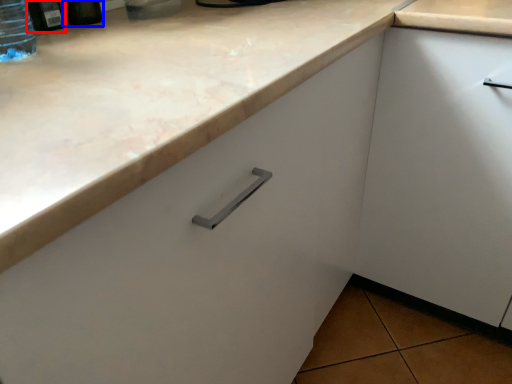
Question: Among these objects, which one is farthest to the camera, bottle (highlighted by a red box) or bottle (highlighted by a blue box)?

Choices:
 (A) bottle
 (B) bottle

Answer: (B)